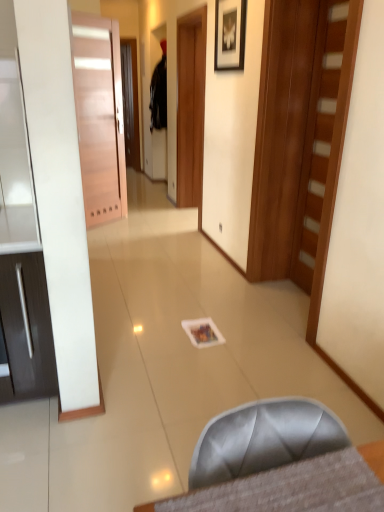
Question: Can you confirm if matte black picture frame at upper center is smaller than black fabric robe at upper center?

Choices:
 (A) no
 (B) yes

Answer: (B)

Question: Is matte black picture frame at upper center taller than black fabric robe at upper center?

Choices:
 (A) no
 (B) yes

Answer: (A)

Question: Is black fabric robe at upper center completely or partially inside matte black picture frame at upper center?

Choices:
 (A) no
 (B) yes

Answer: (A)

Question: Does matte black picture frame at upper center have a lesser height compared to black fabric robe at upper center?

Choices:
 (A) no
 (B) yes

Answer: (B)

Question: Considering the relative positions of matte black picture frame at upper center and black fabric robe at upper center in the image provided, is matte black picture frame at upper center to the right of black fabric robe at upper center from the viewer's perspective?

Choices:
 (A) yes
 (B) no

Answer: (A)

Question: Would you say satin gray chair at lower center is to the left or to the right of matte pink door at left, marked as the 1th door in a left-to-right arrangement, in the picture?

Choices:
 (A) left
 (B) right

Answer: (B)

Question: From a real-world perspective, is satin gray chair at lower center physically located above or below matte pink door at left, placed as the 2th door when sorted from right to left?

Choices:
 (A) above
 (B) below

Answer: (B)

Question: From the image's perspective, is satin gray chair at lower center located above or below matte pink door at left, placed as the 2th door when sorted from right to left?

Choices:
 (A) above
 (B) below

Answer: (B)

Question: Is satin gray chair at lower center bigger or smaller than matte pink door at left, which is the first door in back-to-front order?

Choices:
 (A) small
 (B) big

Answer: (A)

Question: Looking at their shapes, would you say matte pink door at left, which is the first door in back-to-front order, is wider or thinner than wooden door at right, the 1th door when ordered from front to back?

Choices:
 (A) wide
 (B) thin

Answer: (A)

Question: In terms of height, does matte pink door at left, which is the first door in back-to-front order, look taller or shorter compared to wooden door at right, the 1th door when ordered from front to back?

Choices:
 (A) short
 (B) tall

Answer: (B)

Question: Looking at the image, does matte pink door at left, placed as the 2th door when sorted from right to left, seem bigger or smaller compared to wooden door at right, which appears as the second door when viewed from the back?

Choices:
 (A) small
 (B) big

Answer: (B)

Question: From the image's perspective, is matte pink door at left, which is the first door in back-to-front order, positioned above or below wooden door at right, positioned as the first door in right-to-left order?

Choices:
 (A) below
 (B) above

Answer: (B)

Question: From a real-world perspective, is matte pink door at left, which is the first door in back-to-front order, positioned above or below black fabric robe at upper center?

Choices:
 (A) below
 (B) above

Answer: (A)

Question: Considering the positions of matte pink door at left, marked as the 1th door in a left-to-right arrangement, and black fabric robe at upper center in the image, is matte pink door at left, marked as the 1th door in a left-to-right arrangement, taller or shorter than black fabric robe at upper center?

Choices:
 (A) short
 (B) tall

Answer: (B)